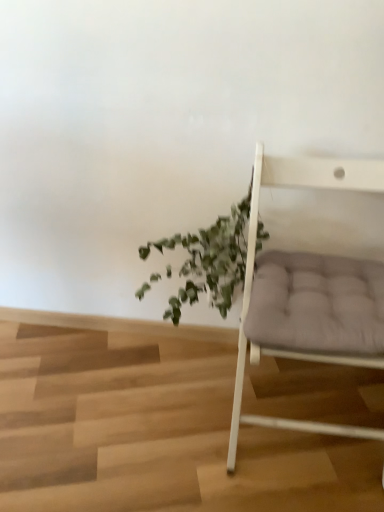
The image size is (384, 512). Find the location of `matte gray cushion at right`. matte gray cushion at right is located at coordinates (254, 262).

What do you see at coordinates (254, 262) in the screenshot? This screenshot has height=512, width=384. I see `matte gray cushion at right` at bounding box center [254, 262].

What are the coordinates of `green leafy plant at center` in the screenshot? It's located at (210, 261).

This screenshot has height=512, width=384. What do you see at coordinates (210, 261) in the screenshot? I see `green leafy plant at center` at bounding box center [210, 261].

Locate an element on the screen. The image size is (384, 512). matte gray cushion at right is located at coordinates (x=254, y=262).

Considering the relative positions of matte gray cushion at right and green leafy plant at center in the image provided, is matte gray cushion at right to the left or to the right of green leafy plant at center?

From the image, it's evident that matte gray cushion at right is to the right of green leafy plant at center.

Considering the positions of objects matte gray cushion at right and green leafy plant at center in the image provided, who is in front, matte gray cushion at right or green leafy plant at center?

Positioned in front is matte gray cushion at right.

Is point (296, 308) closer or farther from the camera than point (217, 260)?

Point (296, 308).

From the image's perspective, which object appears higher, matte gray cushion at right or green leafy plant at center?

green leafy plant at center is shown above in the image.

From a real-world perspective, which object stands above the other?

In real-world perspective, matte gray cushion at right is above.

Looking at their sizes, would you say matte gray cushion at right is wider or thinner than green leafy plant at center?

Considering their sizes, matte gray cushion at right looks broader than green leafy plant at center.

From their relative heights in the image, would you say matte gray cushion at right is taller or shorter than green leafy plant at center?

In the image, matte gray cushion at right appears to be taller than green leafy plant at center.

Considering the sizes of matte gray cushion at right and green leafy plant at center in the image, is matte gray cushion at right bigger or smaller than green leafy plant at center?

Considering their sizes, matte gray cushion at right takes up more space than green leafy plant at center.

Is matte gray cushion at right not within green leafy plant at center?

Yes.

Is there a large distance between matte gray cushion at right and green leafy plant at center?

matte gray cushion at right is near green leafy plant at center, not far away.

Is green leafy plant at center at the back of matte gray cushion at right?

matte gray cushion at right does not have its back to green leafy plant at center.

How different are the orientations of matte gray cushion at right and green leafy plant at center in degrees?

They differ by 1.17 degrees in their facing directions.

Find the location of a particular element. The image size is (384, 512). houseplant that is on the left side of matte gray cushion at right is located at coordinates (210, 261).

In the scene shown: Which is more to the left, green leafy plant at center or matte gray cushion at right?

green leafy plant at center is more to the left.

Consider the image. Is green leafy plant at center further to camera compared to matte gray cushion at right?

Yes.

Is point (195, 247) positioned after point (285, 162)?

Yes, it is behind point (285, 162).

From the image's perspective, does green leafy plant at center appear higher than matte gray cushion at right?

Yes.

From a real-world perspective, is green leafy plant at center located beneath matte gray cushion at right?

Yes, from a real-world perspective, green leafy plant at center is beneath matte gray cushion at right.

Which object is thinner, green leafy plant at center or matte gray cushion at right?

With smaller width is green leafy plant at center.

Looking at this image, can you confirm if green leafy plant at center is taller than matte gray cushion at right?

No, green leafy plant at center is not taller than matte gray cushion at right.

In terms of size, does green leafy plant at center appear bigger or smaller than matte gray cushion at right?

green leafy plant at center is smaller than matte gray cushion at right.

Is green leafy plant at center not within matte gray cushion at right?

Indeed, green leafy plant at center is completely outside matte gray cushion at right.

Would you say green leafy plant at center is a long distance from matte gray cushion at right?

No, green leafy plant at center is in close proximity to matte gray cushion at right.

Looking at this image, is green leafy plant at center oriented away from matte gray cushion at right?

No, green leafy plant at center's orientation is not away from matte gray cushion at right.

What's the angular difference between green leafy plant at center and matte gray cushion at right's facing directions?

The angle between the facing direction of green leafy plant at center and the facing direction of matte gray cushion at right is 1.17 degrees.

Locate an element on the screen. houseplant that appears behind the matte gray cushion at right is located at coordinates point(210,261).

The image size is (384, 512). Identify the location of chair in front of the green leafy plant at center. (254, 262).

The width and height of the screenshot is (384, 512). What are the coordinates of `chair lying below the green leafy plant at center (from the image's perspective)` in the screenshot? It's located at (254, 262).